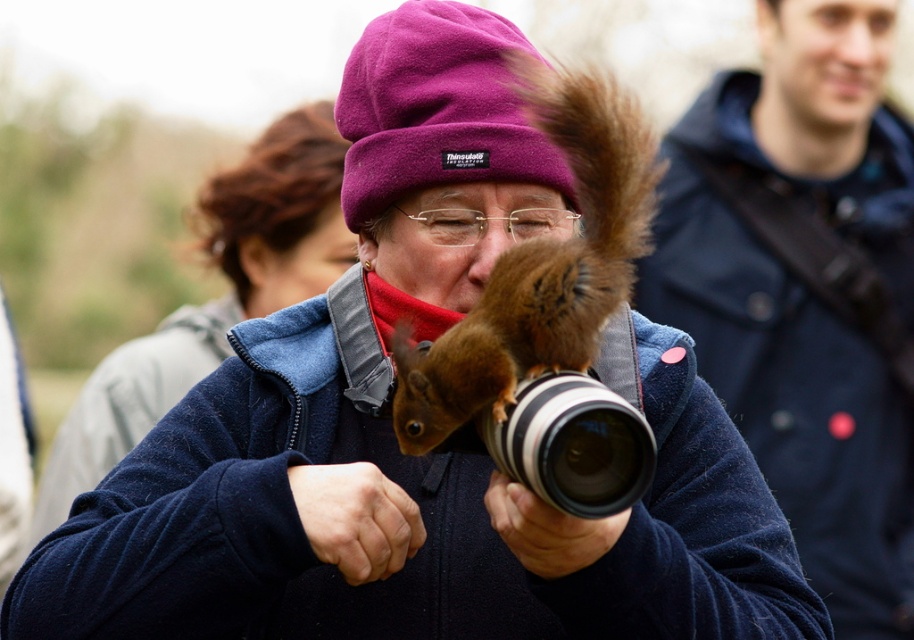
Is point (473, 164) closer to camera compared to point (389, 512)?

No, it is behind (389, 512).

Is purple fleece beanie at center bigger than smooth skin hand at center?

Indeed, purple fleece beanie at center has a larger size compared to smooth skin hand at center.

Find the location of a particular element. purple fleece beanie at center is located at coordinates (436, 109).

I want to click on purple fleece beanie at center, so click(436, 109).

Is velvet blue jacket at center below purple fleece beanie at center?

Yes.

Is velvet blue jacket at center smaller than purple fleece beanie at center?

Incorrect, velvet blue jacket at center is not smaller in size than purple fleece beanie at center.

Where is `velvet blue jacket at center`? This screenshot has height=640, width=914. velvet blue jacket at center is located at coordinates (215, 300).

The image size is (914, 640). I want to click on velvet blue jacket at center, so click(215, 300).

Can you confirm if brown furry squirrel at center is positioned below smooth skin hand at center?

Incorrect, brown furry squirrel at center is not positioned below smooth skin hand at center.

Which of these two, brown furry squirrel at center or smooth skin hand at center, stands shorter?

With less height is smooth skin hand at center.

What do you see at coordinates (540, 268) in the screenshot? The image size is (914, 640). I see `brown furry squirrel at center` at bounding box center [540, 268].

Locate an element on the screen. brown furry squirrel at center is located at coordinates (540, 268).